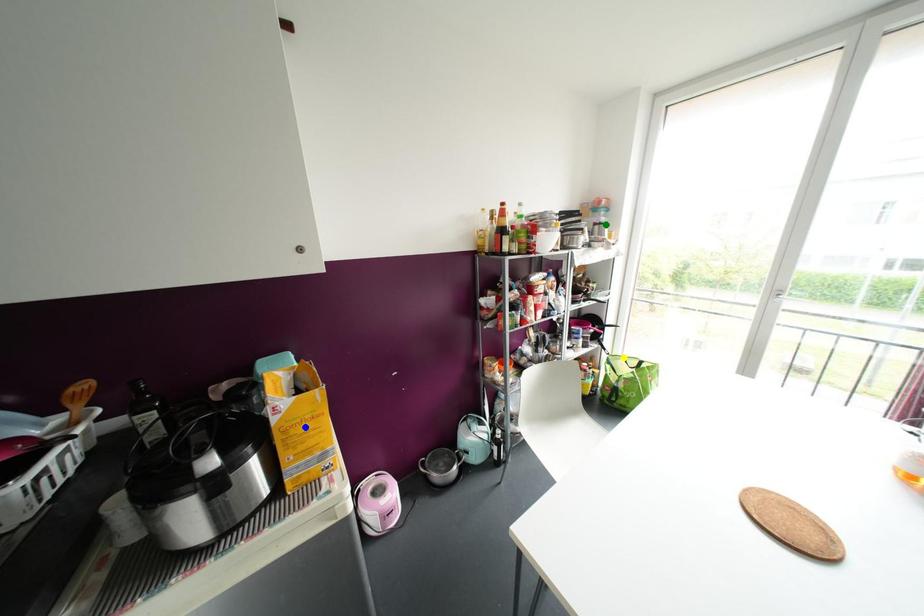
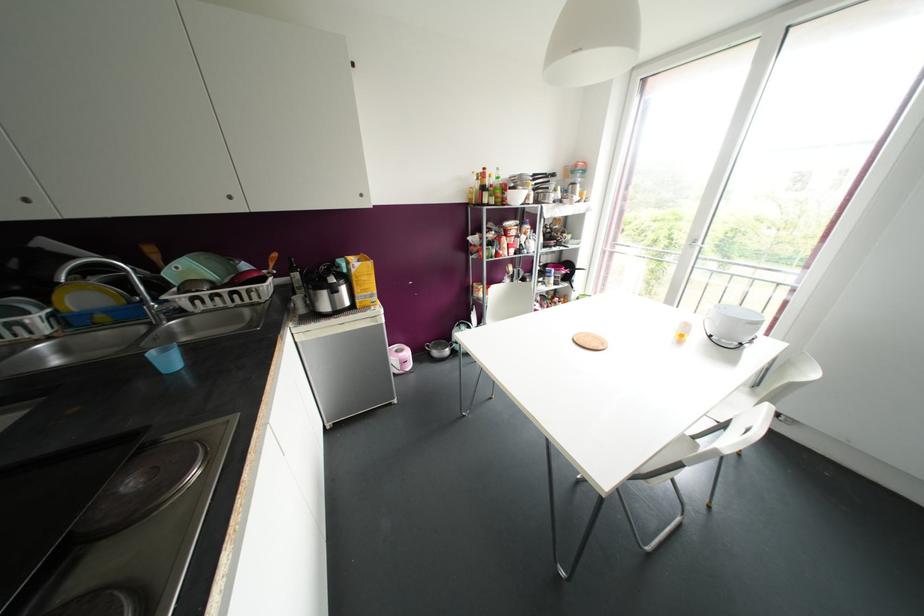
I am providing you with two images of the same scene from different viewpoints. Three points are marked in image1. Which point corresponds to a part or object that is occluded in image2?In image1, three points are marked. Which of them correspond to a part or object that is occluded in image2?Among the three points shown in image1, which one corresponds to a part or object that is no longer visible due to occlusion in image2?

Invisible in image2: yellow point.